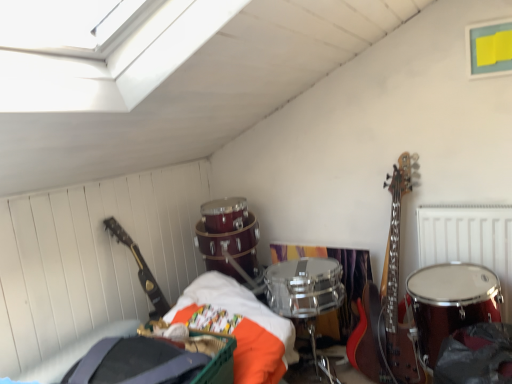
Question: Considering the relative positions of glossy black guitar at left and metallic silver radiator at upper right in the image provided, is glossy black guitar at left to the right of metallic silver radiator at upper right from the viewer's perspective?

Choices:
 (A) yes
 (B) no

Answer: (B)

Question: Can you confirm if glossy black guitar at left is taller than metallic silver radiator at upper right?

Choices:
 (A) no
 (B) yes

Answer: (B)

Question: Is glossy black guitar at left facing towards metallic silver radiator at upper right?

Choices:
 (A) no
 (B) yes

Answer: (A)

Question: Would you consider glossy black guitar at left to be distant from metallic silver radiator at upper right?

Choices:
 (A) yes
 (B) no

Answer: (A)

Question: Can you confirm if glossy black guitar at left is shorter than metallic silver radiator at upper right?

Choices:
 (A) yes
 (B) no

Answer: (B)

Question: Is glossy black guitar at left to the left or to the right of metallic silver radiator at upper right in the image?

Choices:
 (A) left
 (B) right

Answer: (A)

Question: Considering the positions of glossy black guitar at left and metallic silver radiator at upper right in the image, is glossy black guitar at left wider or thinner than metallic silver radiator at upper right?

Choices:
 (A) wide
 (B) thin

Answer: (A)

Question: From a real-world perspective, is glossy black guitar at left above or below metallic silver radiator at upper right?

Choices:
 (A) below
 (B) above

Answer: (B)

Question: Is point (151, 286) positioned closer to the camera than point (453, 258)?

Choices:
 (A) closer
 (B) farther

Answer: (A)

Question: Does point (500, 261) appear closer or farther from the camera than point (440, 342)?

Choices:
 (A) farther
 (B) closer

Answer: (A)

Question: In terms of width, does metallic silver radiator at upper right look wider or thinner when compared to shiny red drum at right?

Choices:
 (A) wide
 (B) thin

Answer: (B)

Question: From the image's perspective, relative to shiny red drum at right, is metallic silver radiator at upper right above or below?

Choices:
 (A) below
 (B) above

Answer: (B)

Question: Considering their positions, is metallic silver radiator at upper right located in front of or behind shiny red drum at right?

Choices:
 (A) behind
 (B) front

Answer: (A)

Question: Looking at their shapes, would you say shiny red drum at right is wider or thinner than glossy black guitar at left?

Choices:
 (A) wide
 (B) thin

Answer: (A)

Question: Looking at the image, does shiny red drum at right seem bigger or smaller compared to glossy black guitar at left?

Choices:
 (A) big
 (B) small

Answer: (A)